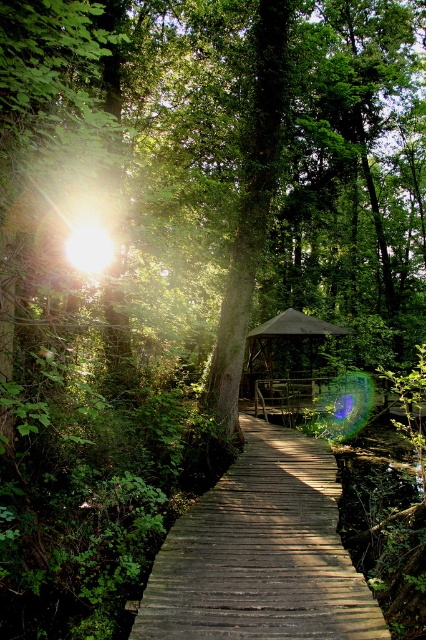
Between wooden planks at center and dark gray fabric gazebo at center, which one appears on the right side from the viewer's perspective?

dark gray fabric gazebo at center

Can you confirm if wooden planks at center is positioned above dark gray fabric gazebo at center?

No.

Does point (265, 556) come farther from viewer compared to point (316, 326)?

That is False.

You are a GUI agent. You are given a task and a screenshot of the screen. Output one action in this format:
    pyautogui.click(x=<x>, y=<y>)
    Task: Click on the wooden planks at center
    The width and height of the screenshot is (426, 640).
    Given the screenshot: What is the action you would take?
    pyautogui.click(x=261, y=554)